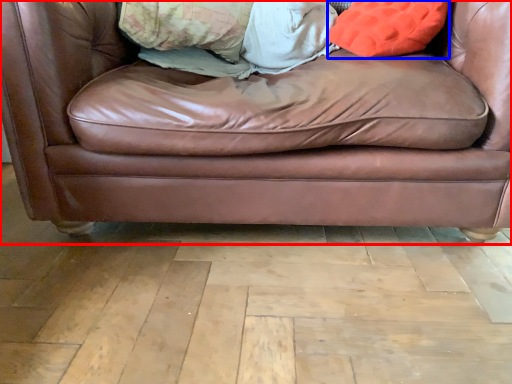
Question: Which point is closer to the camera, studio couch (highlighted by a red box) or throw pillow (highlighted by a blue box)?

Choices:
 (A) studio couch
 (B) throw pillow

Answer: (A)